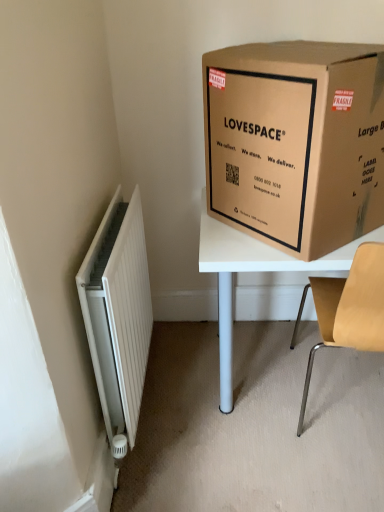
This screenshot has width=384, height=512. What are the coordinates of `vacant space underneath light brown wood chair at right (from a real-world perspective)` in the screenshot? It's located at (330, 402).